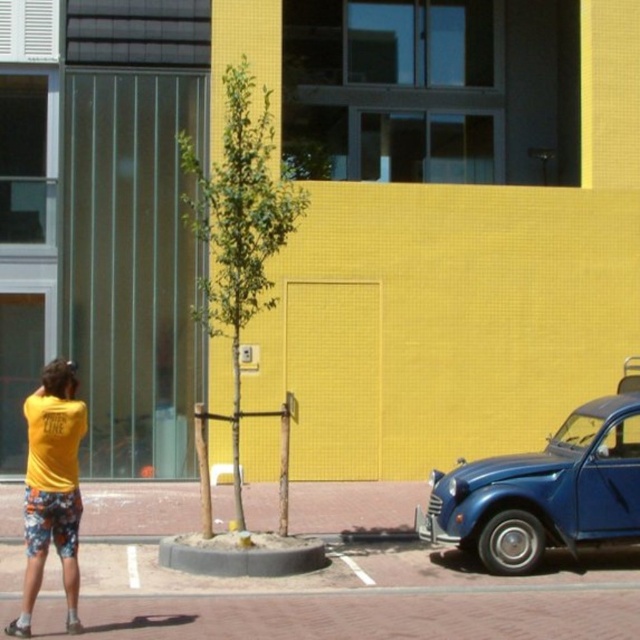
Question: Which of these objects is positioned closest to the yellow matte shorts at lower left?

Choices:
 (A) floral cotton shorts at lower left
 (B) glossy blue car at right

Answer: (A)

Question: Can you confirm if glossy blue car at right is smaller than yellow matte shorts at lower left?

Choices:
 (A) no
 (B) yes

Answer: (A)

Question: Does glossy blue car at right appear on the left side of yellow matte shorts at lower left?

Choices:
 (A) yes
 (B) no

Answer: (B)

Question: Estimate the real-world distances between objects in this image. Which object is closer to the yellow matte shorts at lower left?

Choices:
 (A) floral cotton shorts at lower left
 (B) glossy blue car at right

Answer: (A)

Question: Among these objects, which one is nearest to the camera?

Choices:
 (A) floral cotton shorts at lower left
 (B) glossy blue car at right

Answer: (A)

Question: In this image, where is yellow matte shorts at lower left located relative to floral cotton shorts at lower left?

Choices:
 (A) left
 (B) right

Answer: (A)